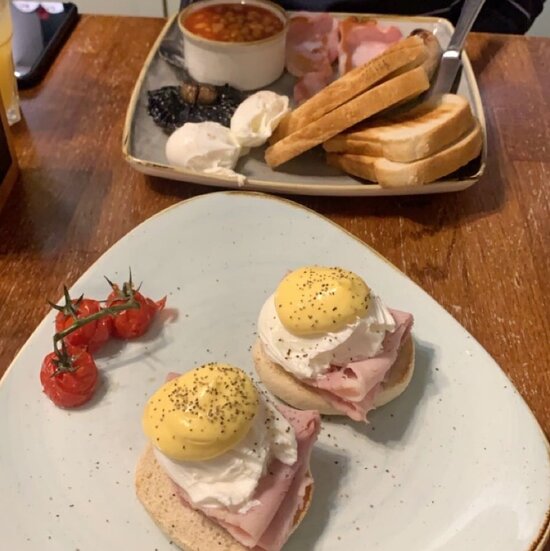
At what (x,y) coordinates should I click in order to perform the action: click on plate. Please return your answer as a coordinate pair (x, y). Looking at the image, I should click on point(150,144).